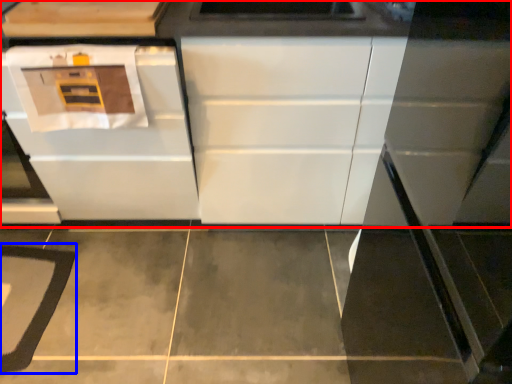
Question: Which object is further to the camera taking this photo, cabinetry (highlighted by a red box) or mat (highlighted by a blue box)?

Choices:
 (A) cabinetry
 (B) mat

Answer: (B)